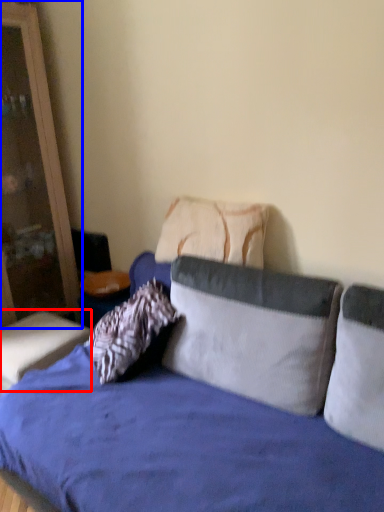
Question: Which object appears farthest to the camera in this image, table (highlighted by a red box) or dresser (highlighted by a blue box)?

Choices:
 (A) table
 (B) dresser

Answer: (A)